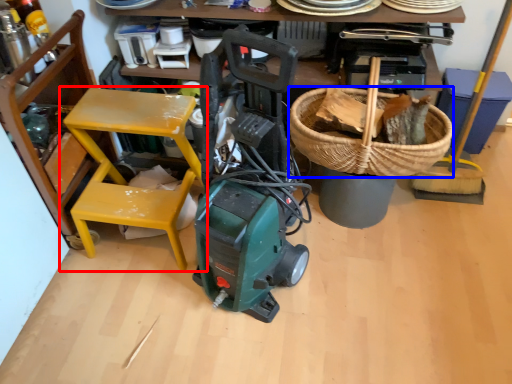
Question: Which object is closer to the camera taking this photo, chair (highlighted by a red box) or basket (highlighted by a blue box)?

Choices:
 (A) chair
 (B) basket

Answer: (A)